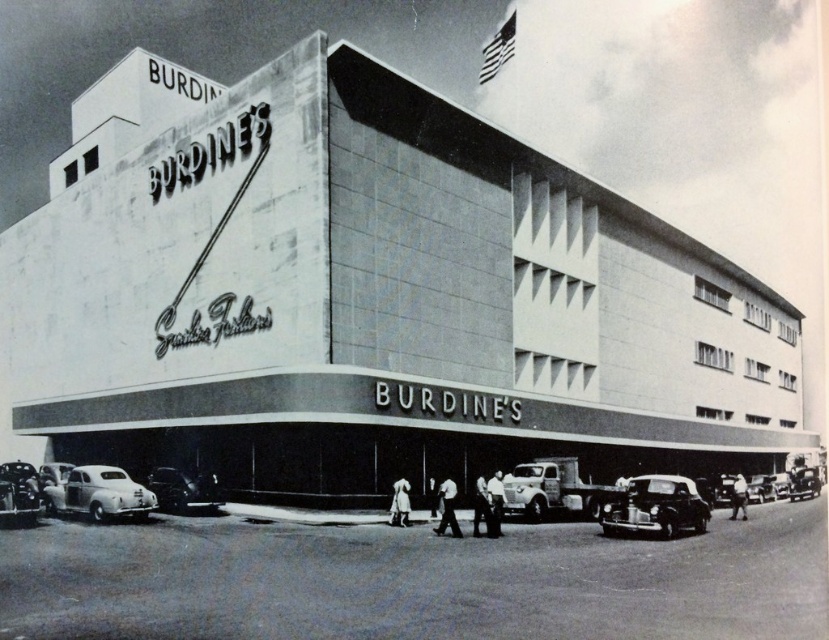
Between smooth concrete building at center and shiny silver car at lower left, which one appears on the right side from the viewer's perspective?

From the viewer's perspective, smooth concrete building at center appears more on the right side.

Is point (561, 337) less distant than point (1, 509)?

No, (561, 337) is further to viewer.

Locate an element on the screen. The height and width of the screenshot is (640, 829). smooth concrete building at center is located at coordinates pos(371,298).

How distant is shiny black car at lower left from shiny silver car at lower left?

shiny black car at lower left is 30.95 feet away from shiny silver car at lower left.

Who is shorter, shiny black car at lower left or shiny silver car at lower left?

shiny black car at lower left is shorter.

Between point (202, 486) and point (22, 465), which one is positioned behind?

The point (22, 465) is behind.

The image size is (829, 640). Find the location of `shiny black car at lower left`. shiny black car at lower left is located at coordinates (183, 490).

Measure the distance between metallic silver truck at center and camera.

The distance of metallic silver truck at center from camera is 168.61 feet.

Describe the element at coordinates (554, 490) in the screenshot. I see `metallic silver truck at center` at that location.

Does point (579, 504) come in front of point (660, 534)?

No, (579, 504) is behind (660, 534).

Image resolution: width=829 pixels, height=640 pixels. What are the coordinates of `metallic silver truck at center` in the screenshot? It's located at (554, 490).